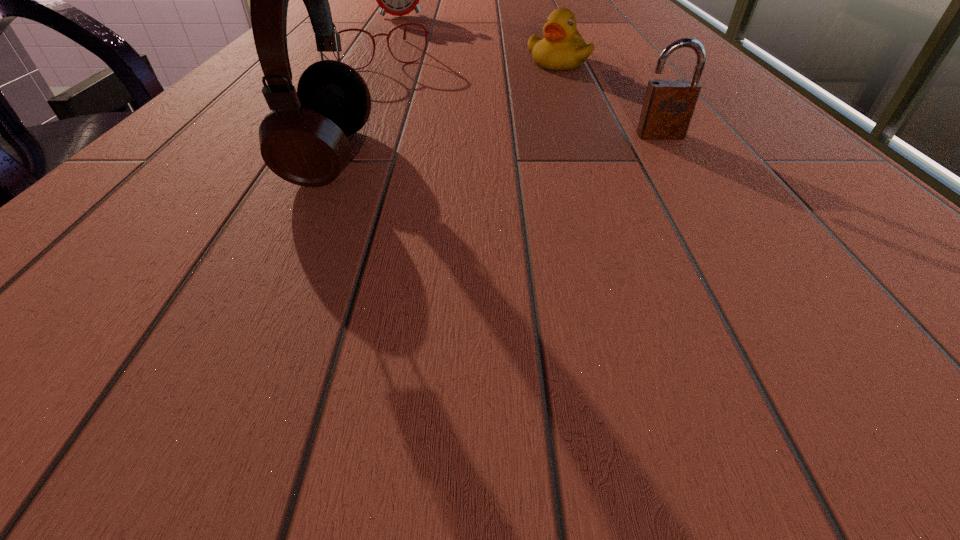
Where is `headset`? The image size is (960, 540). headset is located at coordinates (303, 140).

Identify the location of padlock. (669, 104).

Find the location of a particular element. The image size is (960, 540). spectacles is located at coordinates click(425, 31).

The width and height of the screenshot is (960, 540). In order to click on alarm clock in this screenshot , I will do `click(398, 0)`.

I want to click on the fourth tallest object, so click(x=563, y=48).

I want to click on the second object from right to left, so click(x=563, y=48).

Identify the location of vacant space located on the ear pads of the headset. This screenshot has height=540, width=960. (212, 157).

Identify the location of vacant position located 0.160m on the ear pads of the headset. This screenshot has width=960, height=540. (176, 157).

I want to click on blank area located on the ear pads of the headset, so click(176, 157).

Where is `vacant space located on the front-facing side of the rightmost object`? The height and width of the screenshot is (540, 960). vacant space located on the front-facing side of the rightmost object is located at coordinates coord(749,269).